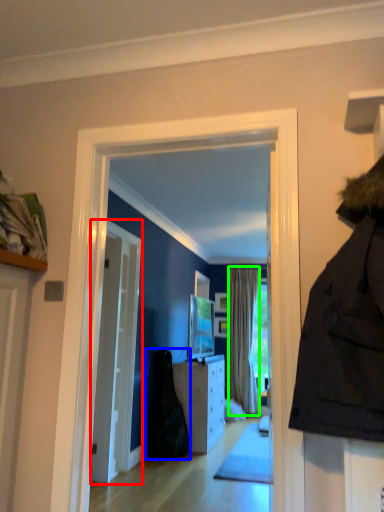
Question: Based on their relative distances, which object is farther from door (highlighted by a red box)? Choose from dark (highlighted by a blue box) and curtain (highlighted by a green box).

Choices:
 (A) dark
 (B) curtain

Answer: (B)